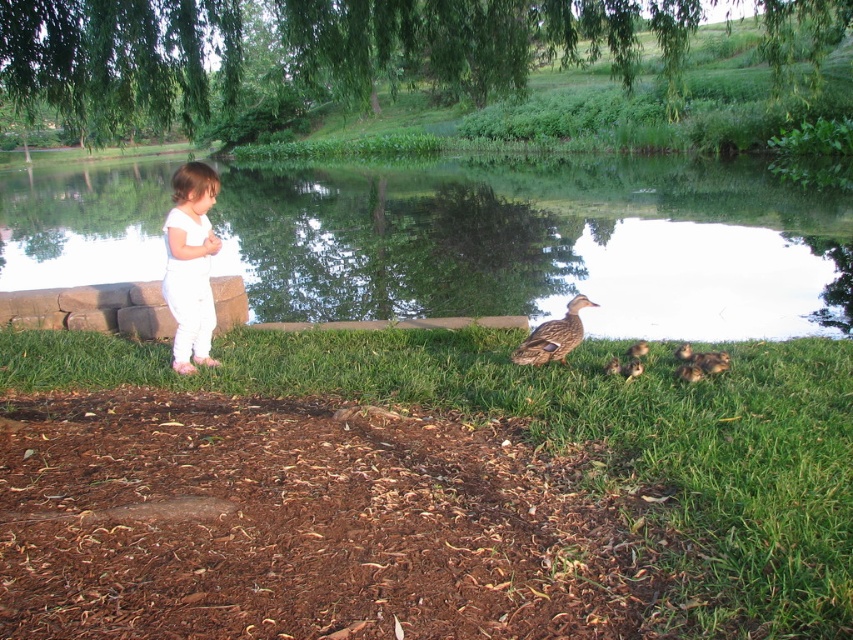
Is white cotton onesie at left to the left of brown matte duck at center from the viewer's perspective?

Yes, white cotton onesie at left is to the left of brown matte duck at center.

In the scene shown: Does white cotton onesie at left come in front of brown matte duck at center?

No.

Which is behind, point (202, 172) or point (552, 340)?

The point (202, 172) is more distant.

Where is `white cotton onesie at left`? white cotton onesie at left is located at coordinates (190, 264).

In the scene shown: Does brown fuzzy ducklings at lower right have a smaller size compared to brown fuzzy duckling at lower center?

Actually, brown fuzzy ducklings at lower right might be larger than brown fuzzy duckling at lower center.

Does brown fuzzy ducklings at lower right come in front of brown fuzzy duckling at lower center?

Yes, it is.

Is point (706, 355) positioned in front of point (631, 348)?

Yes, point (706, 355) is closer to viewer.

What are the coordinates of `brown fuzzy ducklings at lower right` in the screenshot? It's located at (699, 362).

Identify the location of green reflective water at center. (543, 244).

Who is lower down, green reflective water at center or white cotton onesie at left?

white cotton onesie at left is below.

Who is more forward, [3,234] or [200,310]?

Point [200,310] is more forward.

This screenshot has width=853, height=640. In order to click on green reflective water at center in this screenshot , I will do `click(543, 244)`.